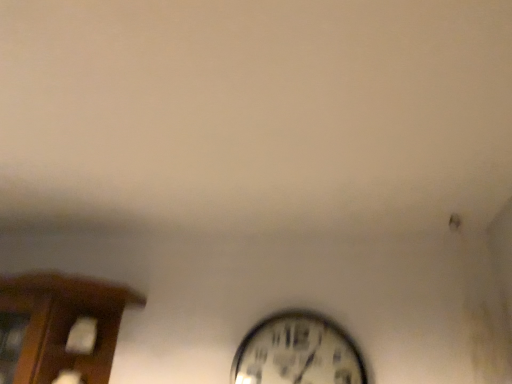
Question: From the image's perspective, is brown wood cabinet at left above or below metallic silver clock at lower center?

Choices:
 (A) below
 (B) above

Answer: (B)

Question: In terms of height, does brown wood cabinet at left look taller or shorter compared to metallic silver clock at lower center?

Choices:
 (A) tall
 (B) short

Answer: (A)

Question: Is brown wood cabinet at left in front of or behind metallic silver clock at lower center in the image?

Choices:
 (A) front
 (B) behind

Answer: (A)

Question: From a real-world perspective, is metallic silver clock at lower center above or below brown wood cabinet at left?

Choices:
 (A) above
 (B) below

Answer: (A)

Question: Is metallic silver clock at lower center situated inside brown wood cabinet at left or outside?

Choices:
 (A) inside
 (B) outside

Answer: (B)

Question: In the image, is metallic silver clock at lower center positioned in front of or behind brown wood cabinet at left?

Choices:
 (A) behind
 (B) front

Answer: (A)

Question: From the image's perspective, is metallic silver clock at lower center located above or below brown wood cabinet at left?

Choices:
 (A) above
 (B) below

Answer: (B)